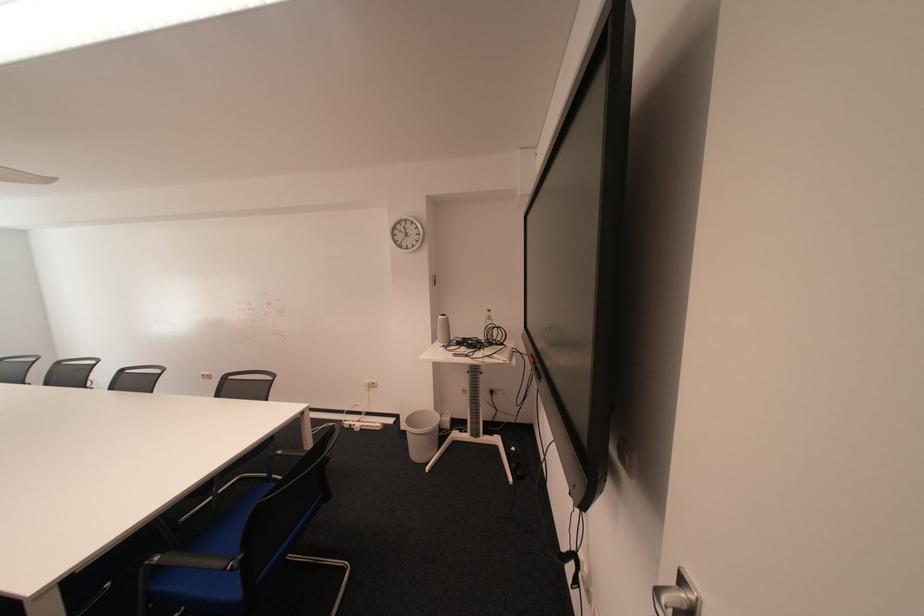
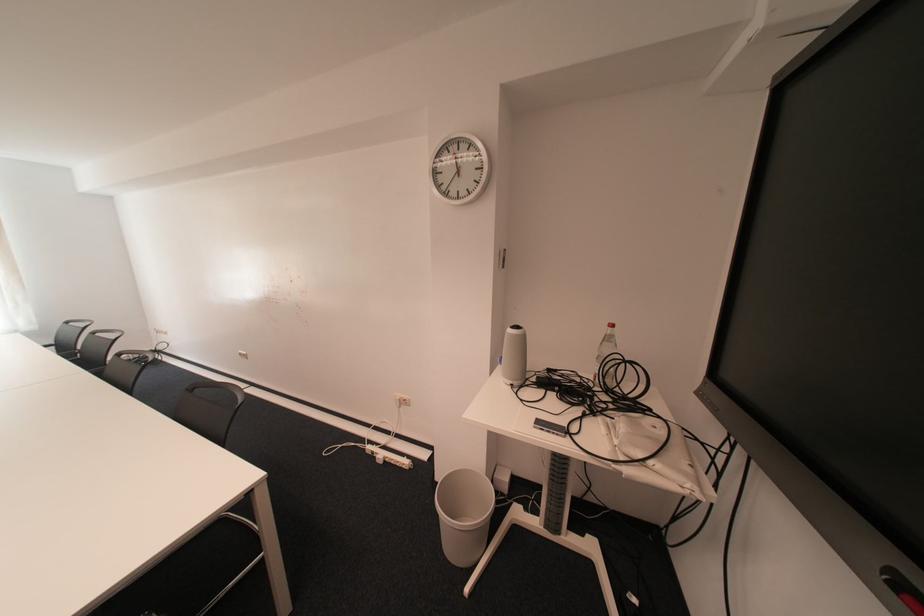
The point at (377, 383) is marked in the first image. Where is the corresponding point in the second image?

(407, 397)